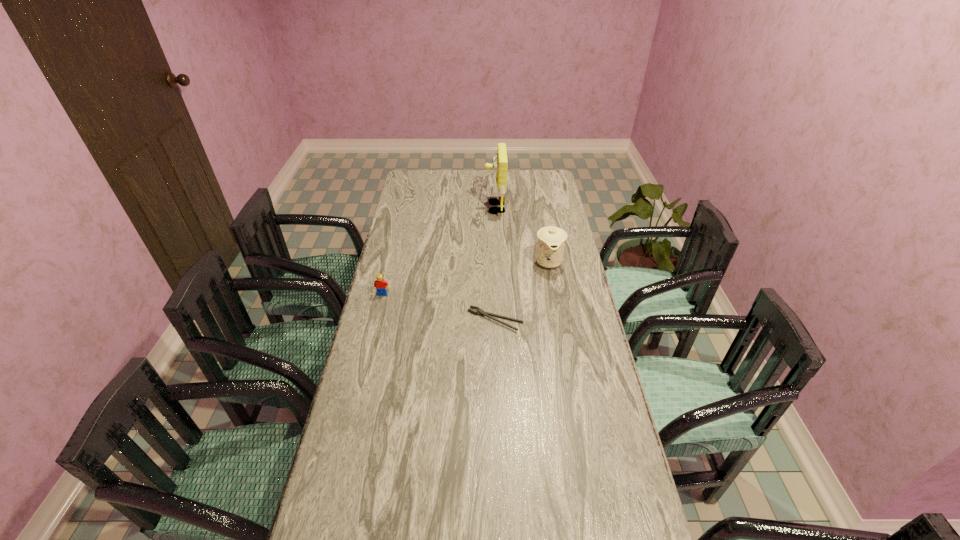
The image size is (960, 540). I want to click on free space that is in between the Lego and the sponge, so click(x=439, y=251).

I want to click on free spot between the rightmost object and the tongs, so click(522, 291).

Locate an element on the screen. vacant space that is in between the nearest object and the second nearest object is located at coordinates (439, 307).

Where is `free space between the leftmost object and the rightmost object`? The height and width of the screenshot is (540, 960). free space between the leftmost object and the rightmost object is located at coordinates (466, 278).

At what (x,y) coordinates should I click in order to perform the action: click on free area in between the chinaware and the third tallest object. Please return your answer as a coordinate pair (x, y). This screenshot has height=540, width=960. Looking at the image, I should click on (466, 278).

Locate an element on the screen. vacant region between the tongs and the tallest object is located at coordinates (494, 264).

Locate an element on the screen. The height and width of the screenshot is (540, 960). free area in between the tongs and the sponge is located at coordinates (494, 264).

Locate an element on the screen. Image resolution: width=960 pixels, height=540 pixels. free space between the sponge and the shortest object is located at coordinates (494, 264).

Locate an element on the screen. This screenshot has width=960, height=540. vacant area that lies between the second shortest object and the tongs is located at coordinates (439, 307).

Find the location of `vacant point located between the farthest object and the shortest object`. vacant point located between the farthest object and the shortest object is located at coordinates (494, 264).